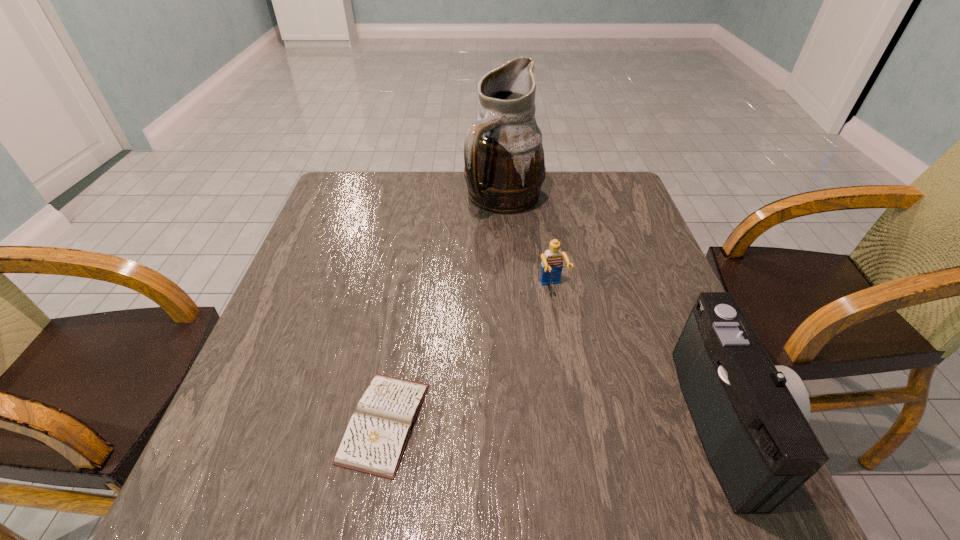
Where is `the shortest object`? This screenshot has width=960, height=540. the shortest object is located at coordinates (376, 436).

I want to click on the leftmost object, so click(376, 436).

Where is `the rightmost object`? the rightmost object is located at coordinates (751, 416).

Locate an element on the screen. The height and width of the screenshot is (540, 960). the third shortest object is located at coordinates (751, 416).

Locate an element on the screen. This screenshot has height=540, width=960. the second farthest object is located at coordinates (552, 260).

You are a GUI agent. You are given a task and a screenshot of the screen. Output one action in this format:
    pyautogui.click(x=<x>, y=<y>)
    Task: Click on the third tallest object
    Image resolution: width=960 pixels, height=540 pixels.
    Given the screenshot: What is the action you would take?
    pyautogui.click(x=552, y=260)

At what (x,y) coordinates should I click in order to perform the action: click on the tallest object. Please return your answer as a coordinate pair (x, y). Looking at the image, I should click on (504, 160).

What are the coordinates of `pitcher` in the screenshot? It's located at (504, 160).

Image resolution: width=960 pixels, height=540 pixels. Identify the location of vacant position located 0.320m on the back of the diary. (411, 266).

In order to click on free location located on the face of the second farthest object in this screenshot , I will do `click(588, 377)`.